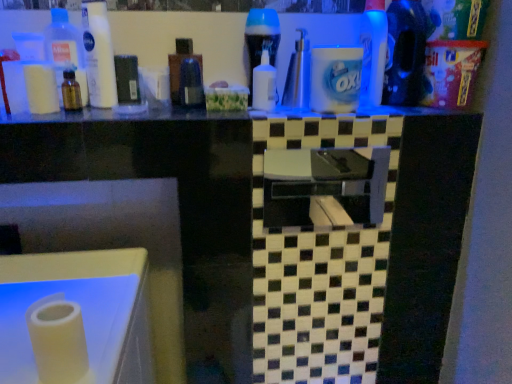
Question: Does blue glossy bottle at upper right, the first cleaning product from the right, have a greater width compared to white matte toilet paper at left?

Choices:
 (A) yes
 (B) no

Answer: (A)

Question: Considering the relative sizes of blue glossy bottle at upper right, the first cleaning product from the right, and white matte toilet paper at left in the image provided, is blue glossy bottle at upper right, the first cleaning product from the right, smaller than white matte toilet paper at left?

Choices:
 (A) yes
 (B) no

Answer: (B)

Question: From the image's perspective, does blue glossy bottle at upper right, the first cleaning product from the right, appear lower than white matte toilet paper at left?

Choices:
 (A) yes
 (B) no

Answer: (B)

Question: Is blue glossy bottle at upper right, which ranks as the third cleaning product in left-to-right order, outside of white matte toilet paper at left?

Choices:
 (A) no
 (B) yes

Answer: (B)

Question: Can you confirm if blue glossy bottle at upper right, the first cleaning product from the right, is shorter than white matte toilet paper at left?

Choices:
 (A) yes
 (B) no

Answer: (B)

Question: From a real-world perspective, is blue glossy bottle at upper right, the first cleaning product from the right, positioned under white matte toilet paper at left based on gravity?

Choices:
 (A) no
 (B) yes

Answer: (A)

Question: Considering the relative positions of blue glossy detergent at upper right, the 2th cleaning product viewed from the right, and white matte paper towel at lower left in the image provided, is blue glossy detergent at upper right, the 2th cleaning product viewed from the right, behind white matte paper towel at lower left?

Choices:
 (A) yes
 (B) no

Answer: (A)

Question: Is blue glossy detergent at upper right, the 2th cleaning product viewed from the right, at the left side of white matte paper towel at lower left?

Choices:
 (A) yes
 (B) no

Answer: (B)

Question: Can you confirm if blue glossy detergent at upper right, which ranks as the 2th cleaning product in left-to-right order, is positioned to the right of white matte paper towel at lower left?

Choices:
 (A) yes
 (B) no

Answer: (A)

Question: From a real-world perspective, does blue glossy detergent at upper right, which ranks as the 2th cleaning product in left-to-right order, sit lower than white matte paper towel at lower left?

Choices:
 (A) yes
 (B) no

Answer: (B)

Question: Considering the relative sizes of blue glossy detergent at upper right, which ranks as the 2th cleaning product in left-to-right order, and white matte paper towel at lower left in the image provided, is blue glossy detergent at upper right, which ranks as the 2th cleaning product in left-to-right order, smaller than white matte paper towel at lower left?

Choices:
 (A) no
 (B) yes

Answer: (A)

Question: From the image's perspective, is blue glossy detergent at upper right, the 2th cleaning product viewed from the right, below white matte paper towel at lower left?

Choices:
 (A) no
 (B) yes

Answer: (A)

Question: From a real-world perspective, is white matte toilet paper at left on top of white matte paper towel at lower left?

Choices:
 (A) no
 (B) yes

Answer: (B)